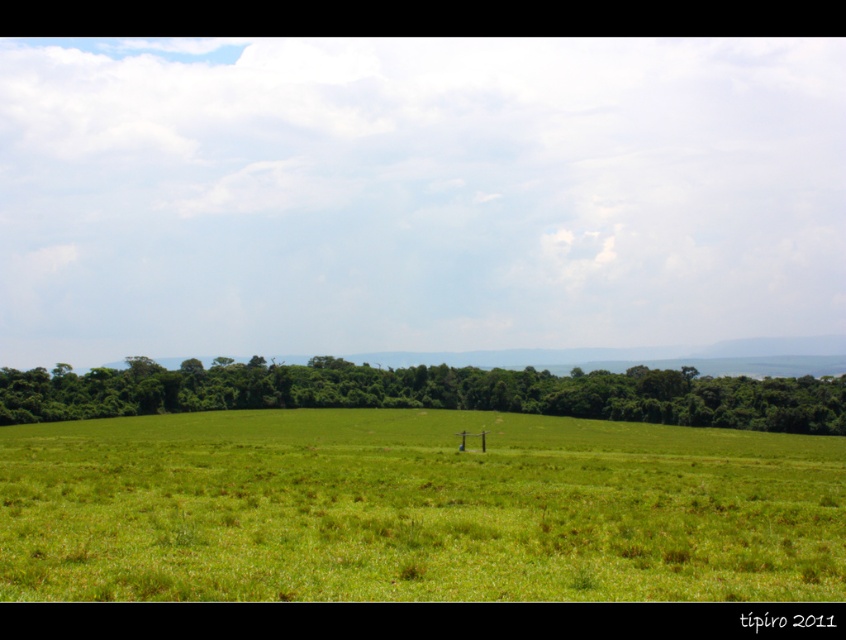
You are standing in the middle of the green grassy pasture at center and want to see the green leafy trees at center. Which direction should you look to see them?

The green leafy trees at center are below the green grassy pasture at center, so you should look downward to see them.

You are standing at point (415, 509) in the grassland. What is the immediate surface beneath your feet?

The immediate surface beneath your feet at point (415, 509) is the green grassy pasture at center.